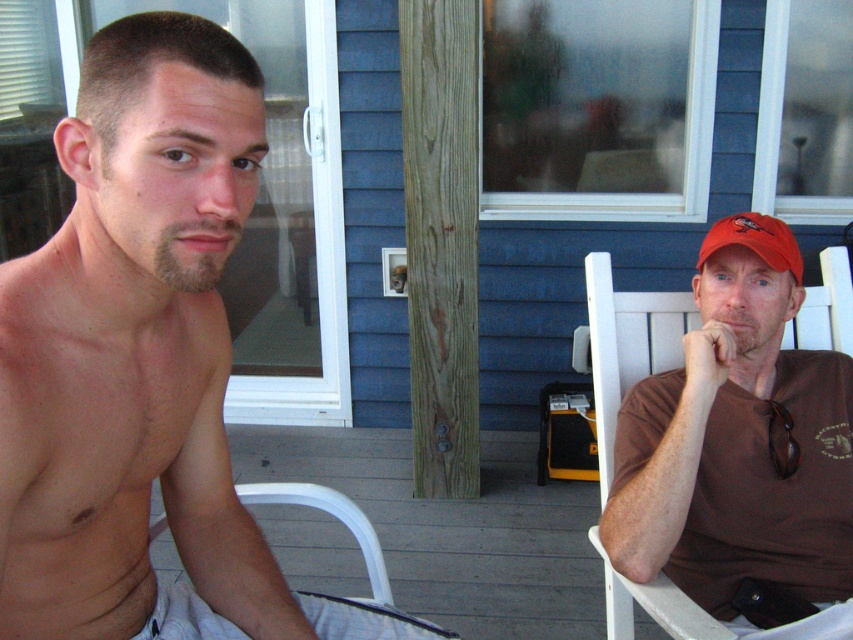
Question: Among these points, which one is farthest from the camera?

Choices:
 (A) (706, 337)
 (B) (703, 259)
 (C) (207, 84)
 (D) (195, 250)

Answer: (B)

Question: Which point is closer to the camera?

Choices:
 (A) (763, 243)
 (B) (750, 493)
 (C) (186, 264)
 (D) (212, 452)

Answer: (C)

Question: Is shiny skin at left thinner than brown matte shirt at right?

Choices:
 (A) yes
 (B) no

Answer: (A)

Question: Is brown matte shirt at right bigger than beige soft facial hair at center?

Choices:
 (A) yes
 (B) no

Answer: (A)

Question: Does shiny skin at left have a larger size compared to brown matte shirt at right?

Choices:
 (A) yes
 (B) no

Answer: (A)

Question: Which point is closer to the camera?

Choices:
 (A) beige soft facial hair at center
 (B) shiny skin at left
 (C) red matte baseball cap at right

Answer: (B)